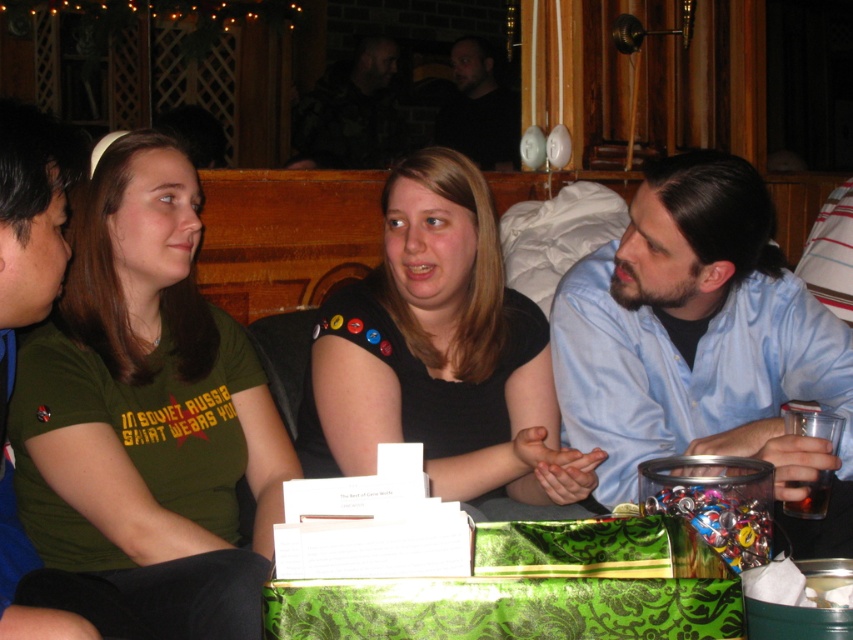
Who is lower down, green matte shirt at left or green fabric shirt at left?

green matte shirt at left is lower down.

Describe the element at coordinates (148, 410) in the screenshot. I see `green matte shirt at left` at that location.

At what (x,y) coordinates should I click in order to perform the action: click on green matte shirt at left. Please return your answer as a coordinate pair (x, y). Looking at the image, I should click on (148, 410).

Between black matte shirt at center and translucent glass cup at lower right, which one appears on the left side from the viewer's perspective?

black matte shirt at center is more to the left.

Who is shorter, black matte shirt at center or translucent glass cup at lower right?

Standing shorter between the two is translucent glass cup at lower right.

Locate an element on the screen. black matte shirt at center is located at coordinates (442, 358).

Does green matte shirt at left have a lesser width compared to black matte shirt at upper center?

No, green matte shirt at left is not thinner than black matte shirt at upper center.

Is green matte shirt at left above black matte shirt at upper center?

Actually, green matte shirt at left is below black matte shirt at upper center.

Which is behind, point (218, 560) or point (456, 108)?

The point (456, 108) is more distant.

Locate an element on the screen. The height and width of the screenshot is (640, 853). green matte shirt at left is located at coordinates (148, 410).